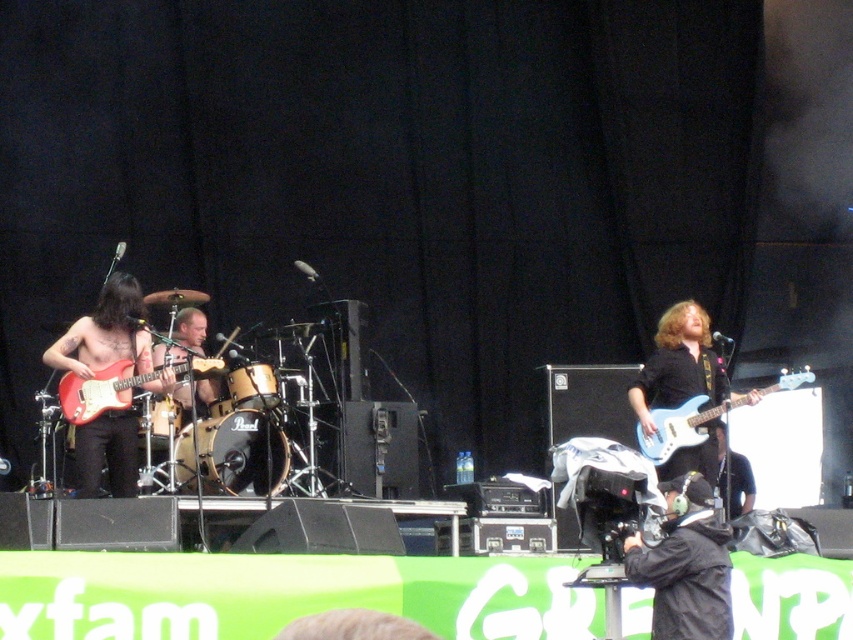
You are a stagehand who needs to move the matte black guitar at left and the matte red electric guitar at left to the storage room. The storage room has a narrow doorway that only allows one guitar to be carried at a time. Based on their positions on stage, which guitar should you move first to ensure you can pass through the doorway without needing to adjust the other guitar?

The matte black guitar at left should be moved first because it is positioned on the left side of the matte red electric guitar at left. By moving the leftmost guitar first, you can carry it through the doorway without needing to adjust the position of the matte red electric guitar at left, which is to its right.

You are a stagehand setting up microphones for the guitars. The microphones require at least 10 cm of clearance above the tallest guitar. Given the height difference between the matte black guitar at left and the matte blue electric guitar at right, will the microphone setup be sufficient?

The matte black guitar at left is taller than the matte blue electric guitar at right. Since the microphones need at least 10 cm clearance above the tallest guitar, you must ensure the microphone is positioned at least 10 cm above the matte black guitar at left to meet the requirement.